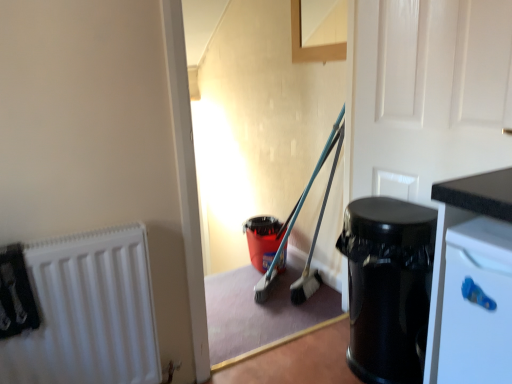
Question: Can you confirm if white matte radiator at left is smaller than black glossy trash can at right?

Choices:
 (A) no
 (B) yes

Answer: (B)

Question: Does white matte radiator at left have a larger size compared to black glossy trash can at right?

Choices:
 (A) no
 (B) yes

Answer: (A)

Question: From a real-world perspective, is white matte radiator at left on top of black glossy trash can at right?

Choices:
 (A) no
 (B) yes

Answer: (B)

Question: Does white matte radiator at left come in front of black glossy trash can at right?

Choices:
 (A) no
 (B) yes

Answer: (B)

Question: Is white matte radiator at left not inside black glossy trash can at right?

Choices:
 (A) yes
 (B) no

Answer: (A)

Question: From the image's perspective, is white glossy door at upper right above or below white matte radiator at left?

Choices:
 (A) below
 (B) above

Answer: (B)

Question: Is white glossy door at upper right bigger or smaller than white matte radiator at left?

Choices:
 (A) big
 (B) small

Answer: (A)

Question: From their relative heights in the image, would you say white glossy door at upper right is taller or shorter than white matte radiator at left?

Choices:
 (A) short
 (B) tall

Answer: (B)

Question: In the image, is white glossy door at upper right on the left side or the right side of white matte radiator at left?

Choices:
 (A) right
 (B) left

Answer: (A)

Question: From their relative heights in the image, would you say white matte radiator at left is taller or shorter than white glossy door at upper right?

Choices:
 (A) short
 (B) tall

Answer: (A)

Question: Is white matte radiator at left inside or outside of white glossy door at upper right?

Choices:
 (A) inside
 (B) outside

Answer: (B)

Question: In the image, is white matte radiator at left positioned in front of or behind white glossy door at upper right?

Choices:
 (A) behind
 (B) front

Answer: (A)

Question: From the image's perspective, relative to white glossy door at upper right, is white matte radiator at left above or below?

Choices:
 (A) below
 (B) above

Answer: (A)

Question: In terms of size, does black glossy trash can at right appear bigger or smaller than white glossy door at upper right?

Choices:
 (A) big
 (B) small

Answer: (A)

Question: Is black glossy trash can at right in front of or behind white glossy door at upper right in the image?

Choices:
 (A) behind
 (B) front

Answer: (A)